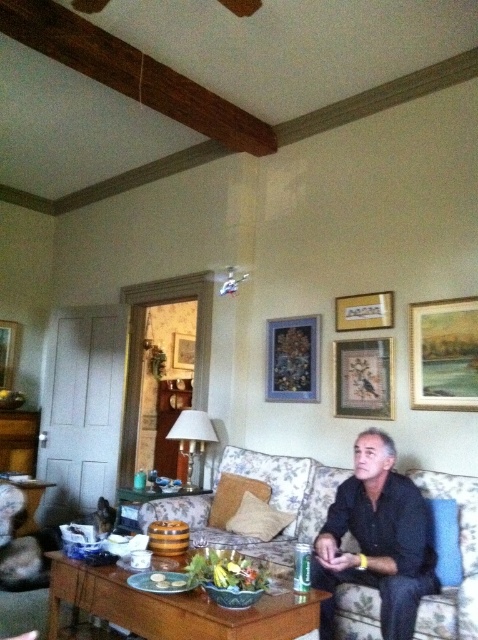
Question: Which object appears closest to the camera in this image?

Choices:
 (A) matte wooden picture frame at upper right
 (B) wooden framed artwork at upper center

Answer: (A)

Question: Which object appears farthest from the camera in this image?

Choices:
 (A) floral fabric couch at center
 (B) wooden frame at center
 (C) wooden framed artwork at upper center
 (D) woodenmaterial/texturetable at lower center

Answer: (B)

Question: Can you confirm if floral fabric couch at center is positioned below wooden framed artwork at upper center?

Choices:
 (A) no
 (B) yes

Answer: (B)

Question: Among these objects, which one is nearest to the camera?

Choices:
 (A) wooden framed picture at upper center
 (B) wooden frame at center

Answer: (A)

Question: Can you confirm if dark blue shirt at center is positioned below wooden framed artwork at upper center?

Choices:
 (A) yes
 (B) no

Answer: (A)

Question: Is wooden picture frame at left in front of wooden picture frame at center?

Choices:
 (A) yes
 (B) no

Answer: (A)